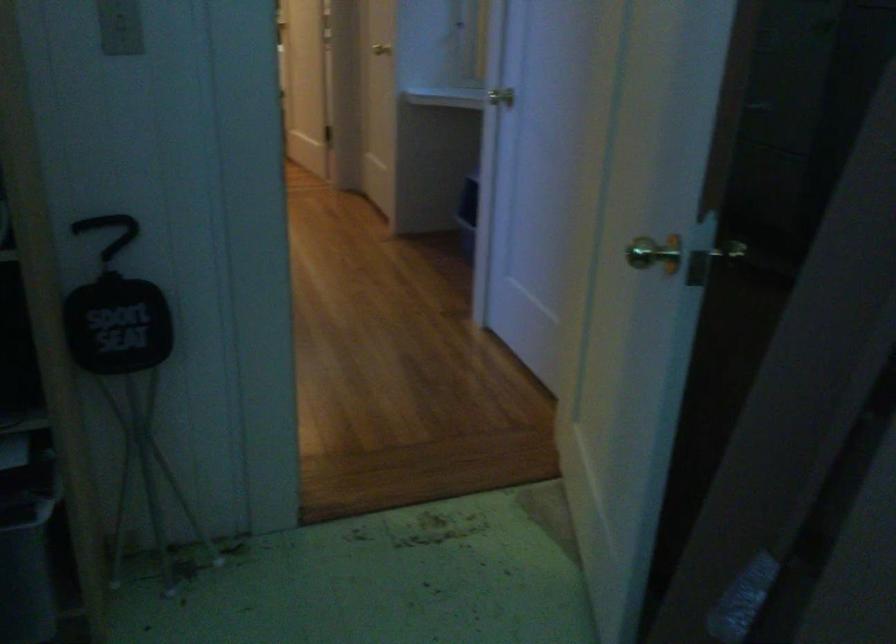
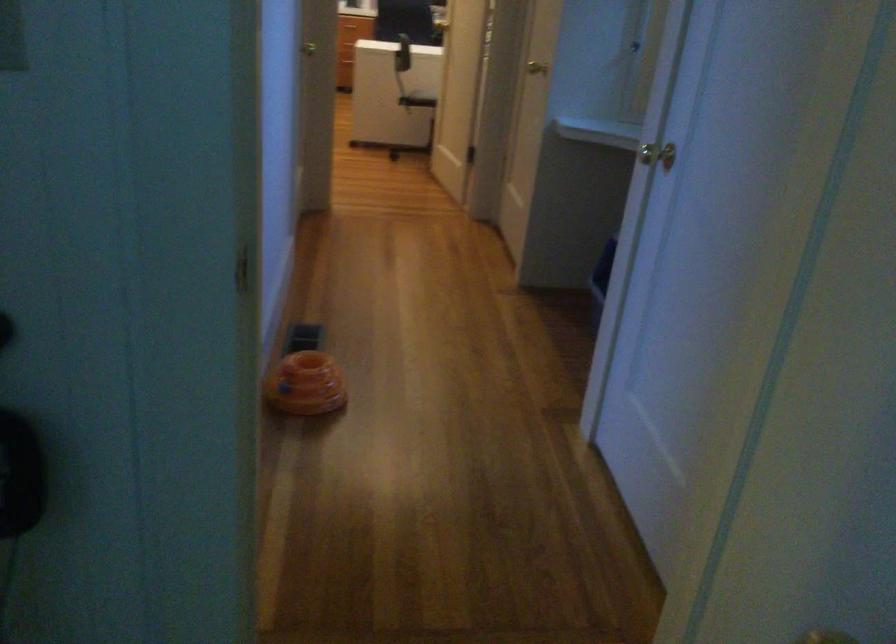
Question: Based on the continuous images, in which direction is the camera rotating? Reply with the corresponding letter.

Choices:
 (A) Left
 (B) Right
 (C) Up
 (D) Down

Answer: (A)